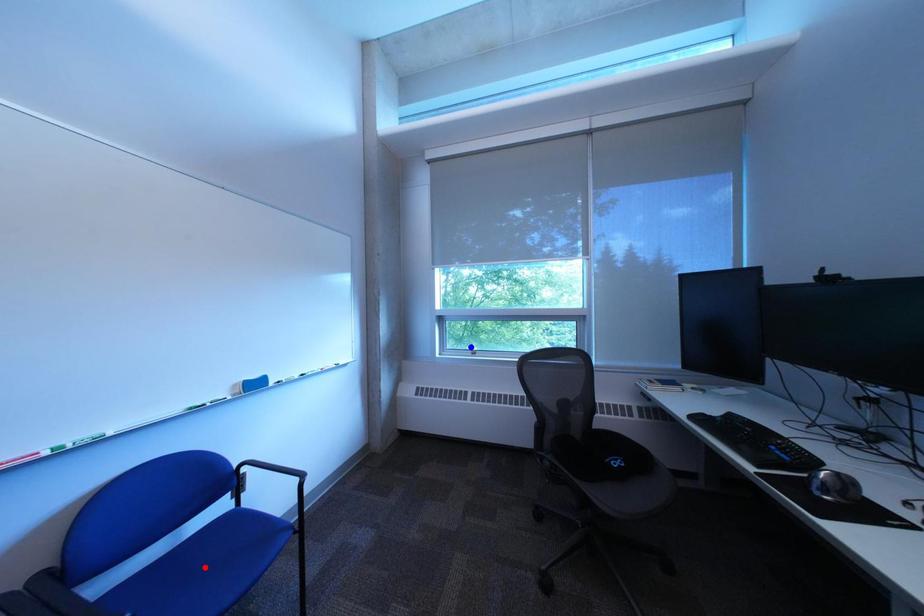
Question: In the image, two points are highlighted. Which point is nearer to the camera? Reply with the corresponding letter.

Choices:
 (A) blue point
 (B) red point

Answer: (B)